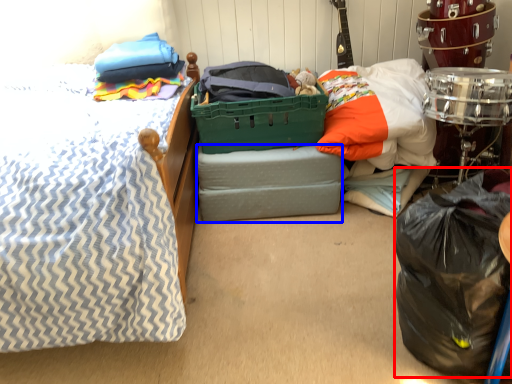
Question: Among these objects, which one is nearest to the camera, garbage (highlighted by a red box) or storage box (highlighted by a blue box)?

Choices:
 (A) garbage
 (B) storage box

Answer: (A)